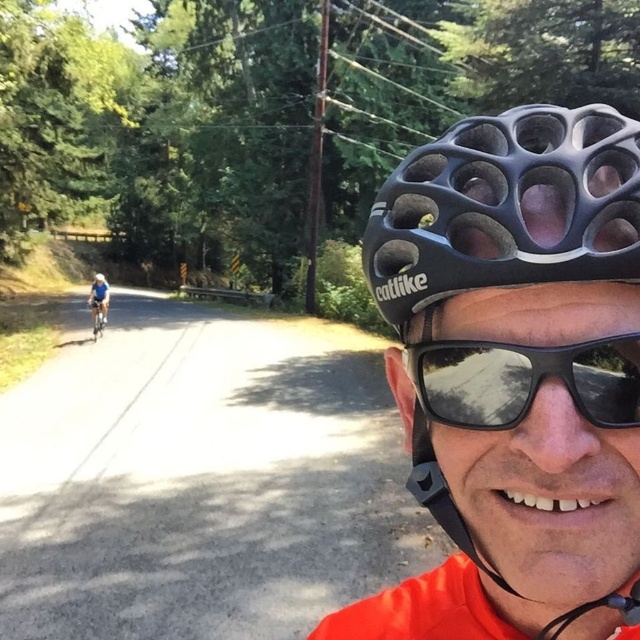
Question: Is silver metallic bicycle at center below matte black helmet at center?

Choices:
 (A) yes
 (B) no

Answer: (A)

Question: Which of these objects is positioned farthest from the black reflective sunglasses at center?

Choices:
 (A) black matte bicycle helmet at center
 (B) silver metallic bicycle at center
 (C) blue fabric jersey at left

Answer: (C)

Question: Among these points, which one is nearest to the camera?

Choices:
 (A) (102, 305)
 (B) (99, 276)
 (C) (108, 292)

Answer: (B)

Question: Can you confirm if blue fabric jersey at left is positioned above silver metallic bicycle at center?

Choices:
 (A) no
 (B) yes

Answer: (B)

Question: Does black reflective sunglasses at center have a larger size compared to silver metallic bicycle at center?

Choices:
 (A) yes
 (B) no

Answer: (B)

Question: Which of the following is the closest to the observer?

Choices:
 (A) (100, 307)
 (B) (96, 273)
 (C) (97, 280)
 (D) (394, 214)

Answer: (D)